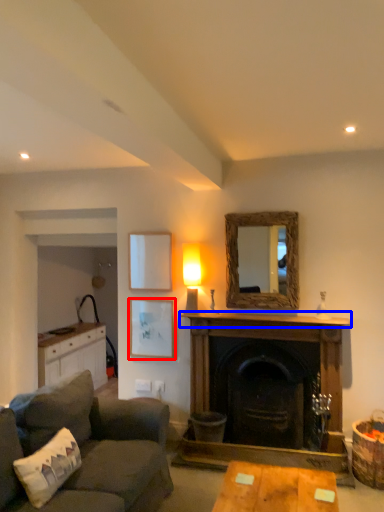
Question: Which object is further to the camera taking this photo, picture frame (highlighted by a red box) or mantle (highlighted by a blue box)?

Choices:
 (A) picture frame
 (B) mantle

Answer: (A)